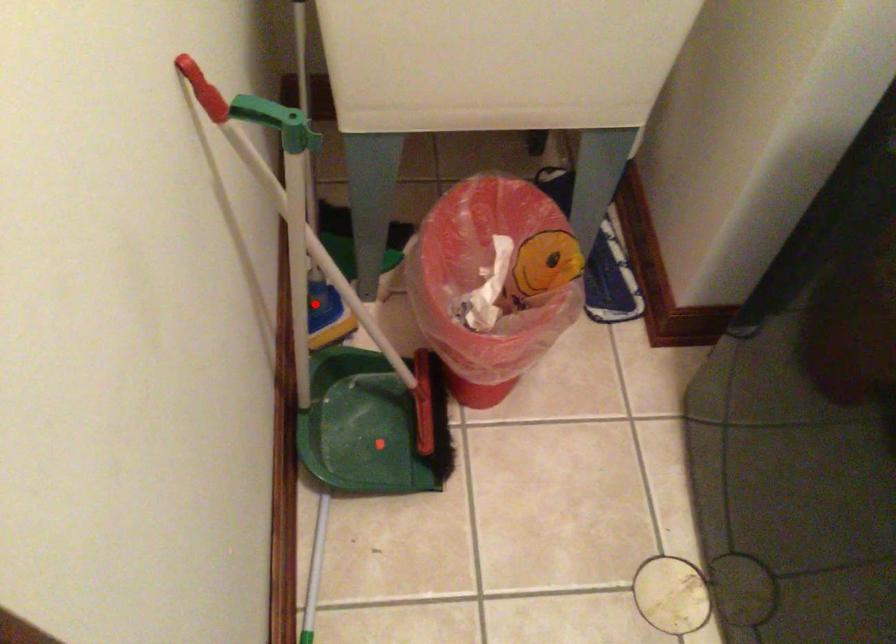
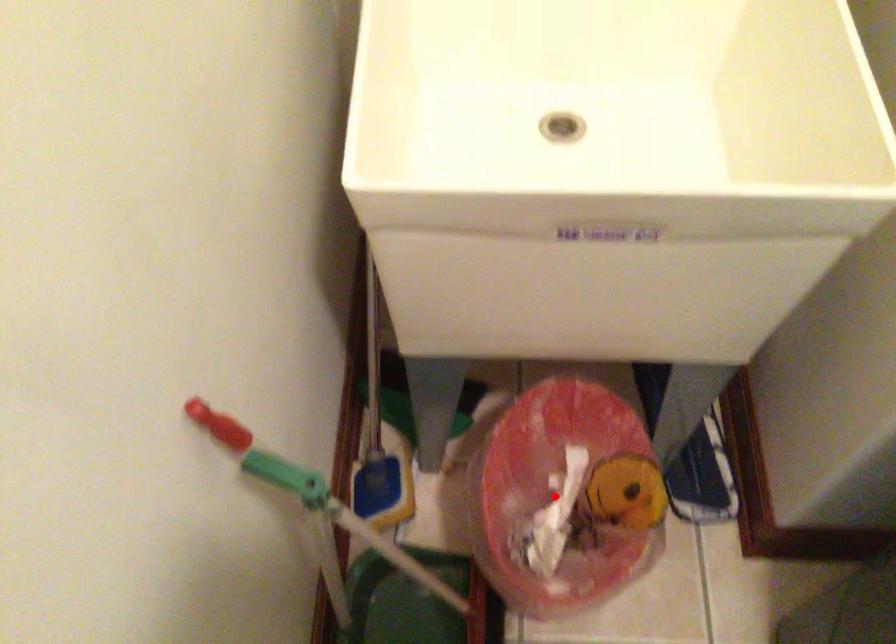
I am providing you with two images of the same scene from different viewpoints. A red point is marked on the first image and another point is marked on the second image. Does the point marked in image1 correspond to the same location as the one in image2?

No